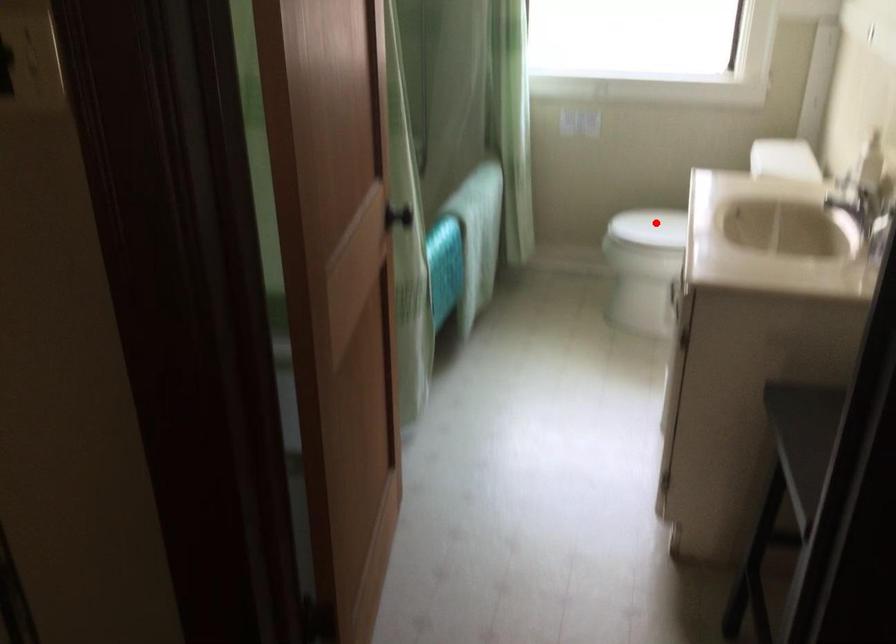
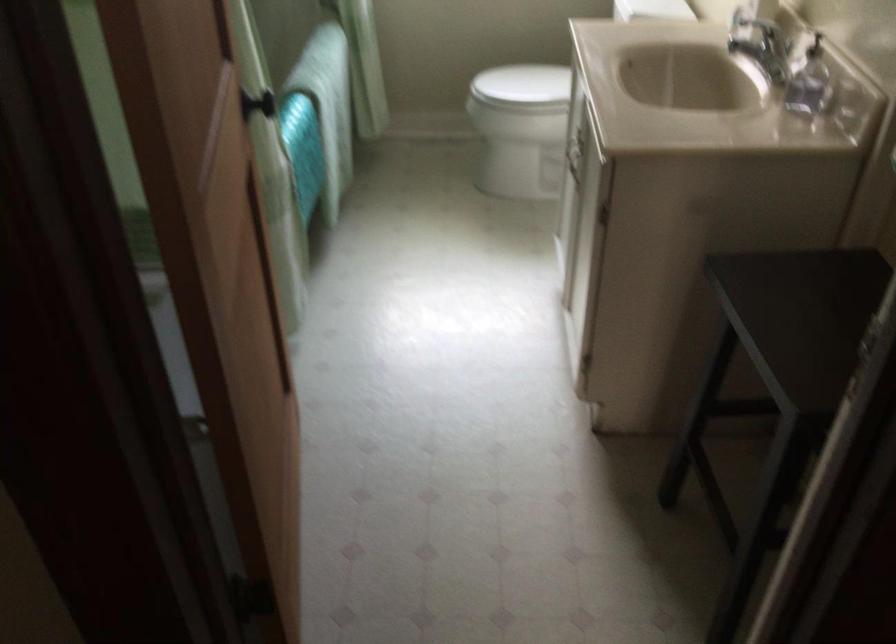
Locate, in the second image, the point that corresponds to the highlighted location in the first image.

(522, 84)